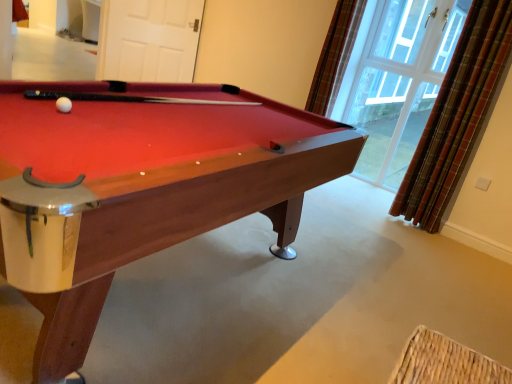
Where is `free space to the left of plaid fabric curtain at right, acting as the 1th curtain starting from the right`? The height and width of the screenshot is (384, 512). free space to the left of plaid fabric curtain at right, acting as the 1th curtain starting from the right is located at coordinates (374, 209).